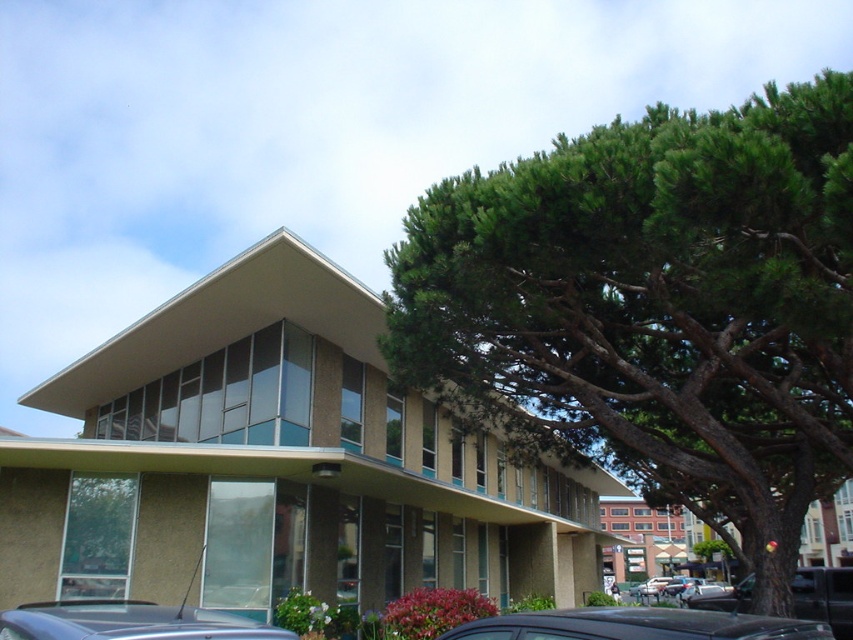
Question: Is green leafy tree at upper right to the right of black matte car at lower center from the viewer's perspective?

Choices:
 (A) no
 (B) yes

Answer: (A)

Question: Which object appears closest to the camera in this image?

Choices:
 (A) black matte car at lower center
 (B) metallic gray car at lower left

Answer: (B)

Question: Among these points, which one is nearest to the camera?

Choices:
 (A) (442, 216)
 (B) (45, 604)

Answer: (A)

Question: Which object is closer to the camera taking this photo?

Choices:
 (A) black matte car at lower center
 (B) metallic gray car at lower left

Answer: (B)

Question: In this image, where is black matte car at lower center located relative to metallic gray car at lower left?

Choices:
 (A) right
 (B) left

Answer: (A)

Question: Is green leafy tree at upper right to the left of black matte car at lower center from the viewer's perspective?

Choices:
 (A) no
 (B) yes

Answer: (B)